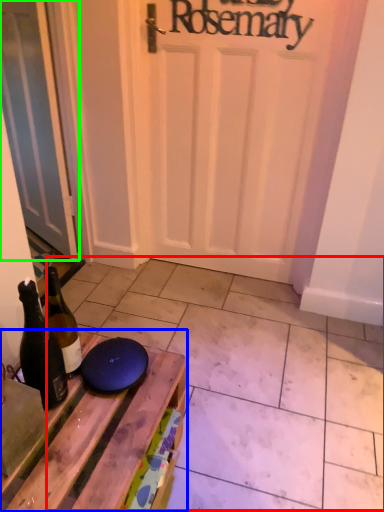
Question: Which object is the closest to the tile (highlighted by a red box)? Choose among these: table (highlighted by a blue box) or door (highlighted by a green box).

Choices:
 (A) table
 (B) door

Answer: (A)